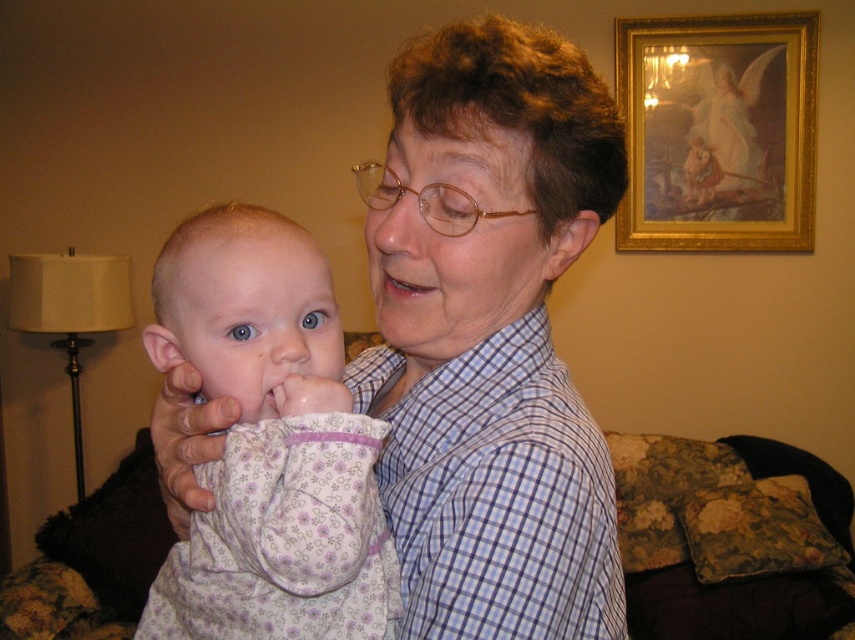
Is point (464, 358) closer to viewer compared to point (800, 49)?

Yes.

Does blue checkered shirt at center have a greater height compared to gold-framed painting at upper right?

Answer: Incorrect, blue checkered shirt at center's height is not larger of gold-framed painting at upper right's.

Locate an element on the screen. The image size is (855, 640). blue checkered shirt at center is located at coordinates tap(500, 499).

Between point (174, 336) and point (715, 216), which one is positioned behind?

Positioned behind is point (715, 216).

Does fluffy white blanket at center come in front of gold-framed painting at upper right?

Yes, it is.

This screenshot has height=640, width=855. Describe the element at coordinates (269, 444) in the screenshot. I see `fluffy white blanket at center` at that location.

Image resolution: width=855 pixels, height=640 pixels. I want to click on fluffy white blanket at center, so click(269, 444).

Does gold-framed painting at upper right have a greater width compared to pink glossy lips at center?

Yes, gold-framed painting at upper right is wider than pink glossy lips at center.

Does point (750, 170) come farther from viewer compared to point (411, 296)?

Yes, point (750, 170) is behind point (411, 296).

Which is in front, point (667, 218) or point (375, 276)?

Positioned in front is point (375, 276).

You are a GUI agent. You are given a task and a screenshot of the screen. Output one action in this format:
    pyautogui.click(x=<x>, y=<y>)
    Task: Click on the gold-framed painting at upper right
    The width and height of the screenshot is (855, 640).
    Given the screenshot: What is the action you would take?
    pyautogui.click(x=718, y=131)